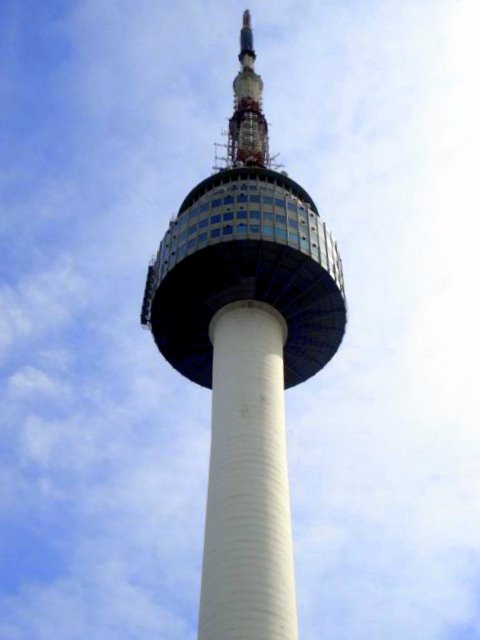
Locate an element on the screen. This screenshot has width=480, height=640. cylindrical pillar is located at coordinates (259, 496).